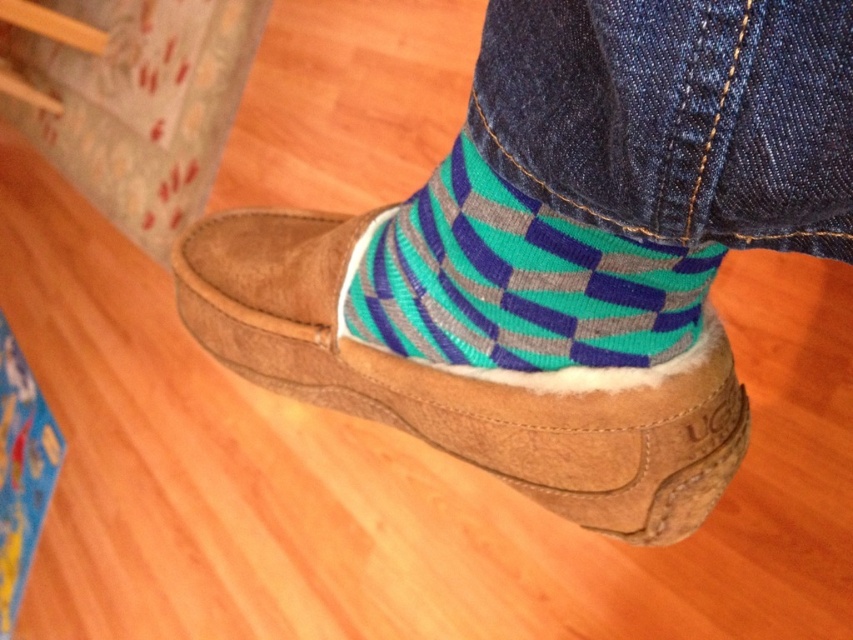
Question: Which object is positioned farthest from the teal/grey striped sock at lower center?

Choices:
 (A) dark blue denim jeans at lower center
 (B) suede slipper at center

Answer: (A)

Question: Which object is positioned farthest from the suede slipper at center?

Choices:
 (A) teal/grey striped sock at lower center
 (B) dark blue denim jeans at lower center

Answer: (B)

Question: Does dark blue denim jeans at lower center have a lesser width compared to suede slipper at center?

Choices:
 (A) yes
 (B) no

Answer: (A)

Question: Does dark blue denim jeans at lower center have a greater width compared to teal/grey striped sock at lower center?

Choices:
 (A) no
 (B) yes

Answer: (A)

Question: Is suede slipper at center further to the viewer compared to teal/grey striped sock at lower center?

Choices:
 (A) yes
 (B) no

Answer: (A)

Question: Which point is closer to the camera taking this photo?

Choices:
 (A) (219, 227)
 (B) (642, 291)
 (C) (608, 45)

Answer: (C)